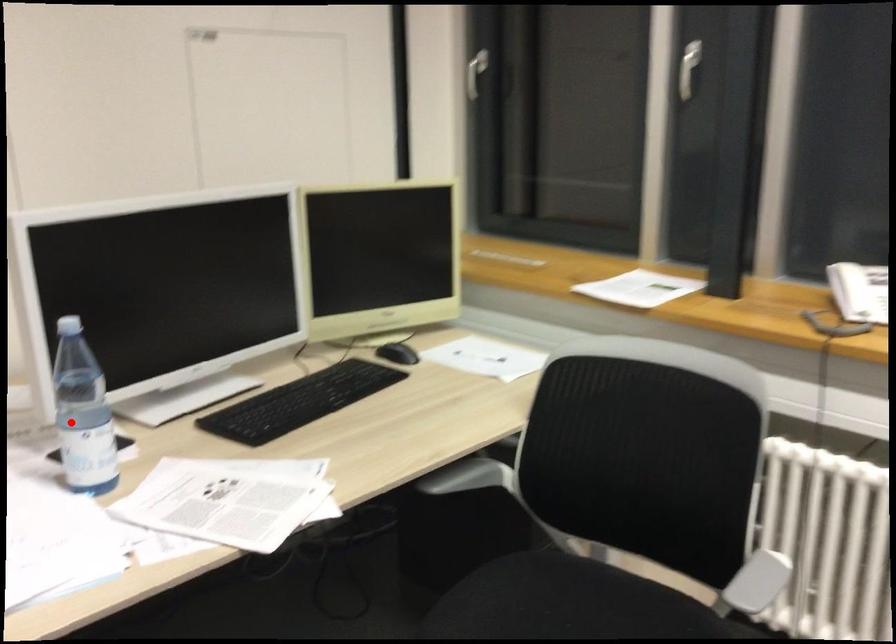
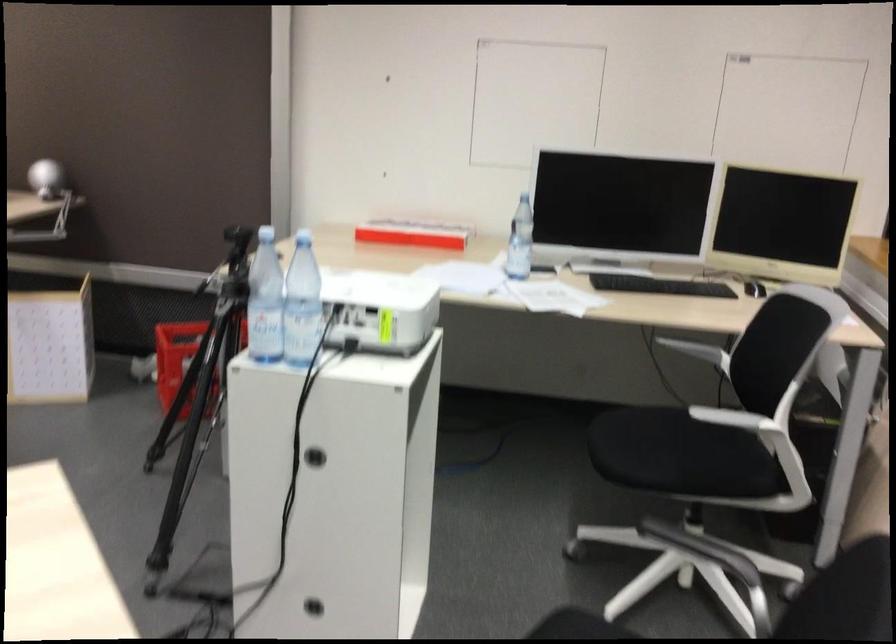
Where in the second image is the point corresponding to the highlighted location from the first image?

(520, 241)